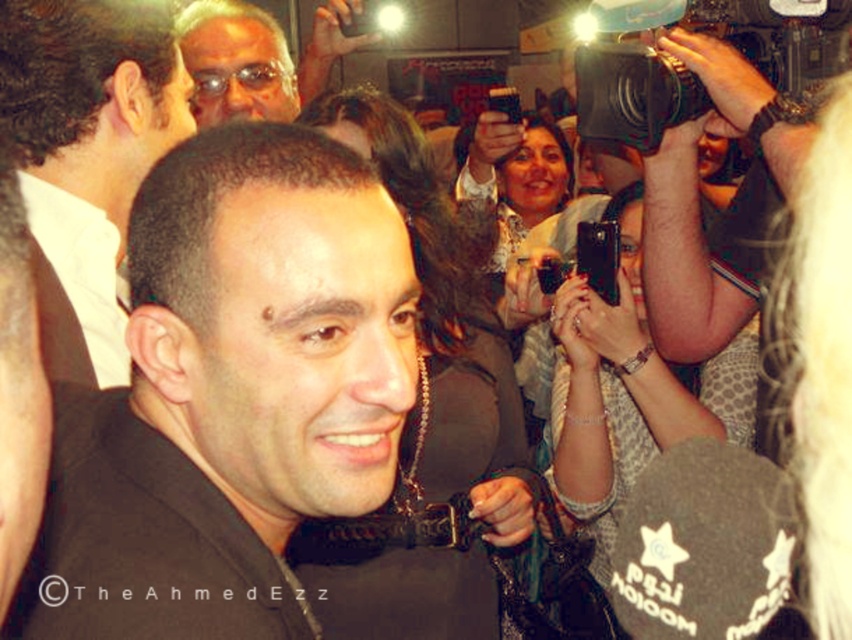
You are at an event and want to take a photo of the central figure. The black satin suit at center and the black glossy bow tie at center are both in the frame. If you want to focus on the wider object, which one should you aim your camera at?

The black satin suit at center is wider than the black glossy bow tie at center, so you should aim your camera at the black satin suit at center to focus on the wider object.

You are standing in the crowd at this event and notice two points marked in the image. Which point, point (297, 285) or point (102, 275), is closer to you?

Point (297, 285) is closer to the viewer than point (102, 275).